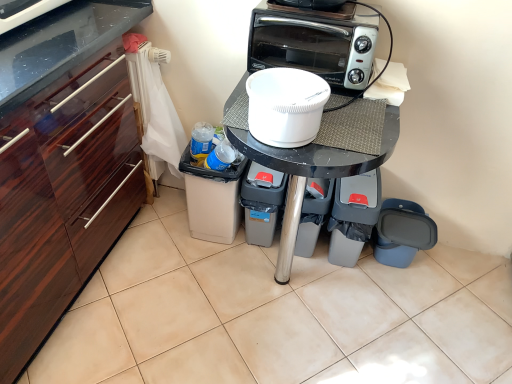
Find the location of `vacant space that's between black glossy table at center and gray plastic trash can at lower right, which ranks as the 3th appliance in left-to-right order`. vacant space that's between black glossy table at center and gray plastic trash can at lower right, which ranks as the 3th appliance in left-to-right order is located at coordinates (349, 299).